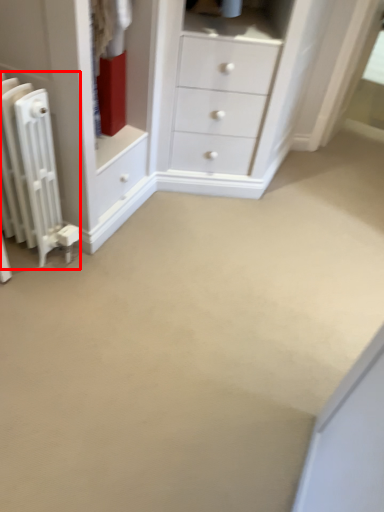
Question: Observing the image, what is the correct spatial positioning of radiator (annotated by the red box) in reference to chest of drawers?

Choices:
 (A) right
 (B) left

Answer: (B)